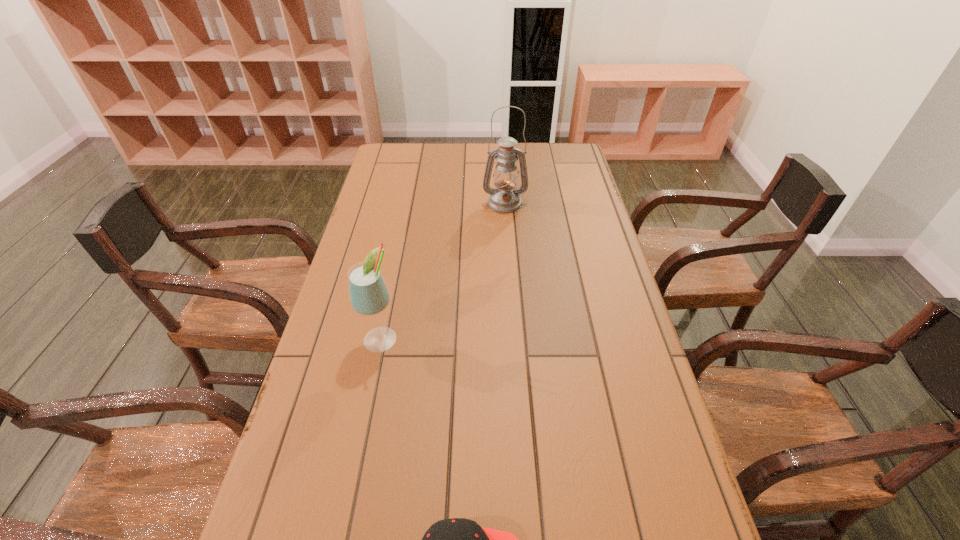
The height and width of the screenshot is (540, 960). In order to click on oil lamp in this screenshot , I will do `click(505, 198)`.

This screenshot has width=960, height=540. In order to click on the tallest object in this screenshot , I will do `click(505, 198)`.

Identify the location of the leftmost object. The image size is (960, 540). (369, 295).

Where is `the second tallest object`? This screenshot has width=960, height=540. the second tallest object is located at coordinates (369, 295).

Image resolution: width=960 pixels, height=540 pixels. I want to click on vacant area located on the right of the farthest object, so click(584, 203).

Locate an element on the screen. free spot located 0.360m on the front of the second farthest object is located at coordinates (346, 514).

What are the coordinates of `object that is at the left edge` in the screenshot? It's located at (369, 295).

In the image, there is a desktop. Find the location of `vacant space at the far edge`. vacant space at the far edge is located at coordinates (531, 171).

Where is `blank space at the left edge of the desktop`? The height and width of the screenshot is (540, 960). blank space at the left edge of the desktop is located at coordinates (348, 271).

You are a GUI agent. You are given a task and a screenshot of the screen. Output one action in this format:
    pyautogui.click(x=<x>, y=<y>)
    Task: Click on the vacant space at the right edge of the desktop
    The width and height of the screenshot is (960, 540).
    Given the screenshot: What is the action you would take?
    pyautogui.click(x=571, y=319)